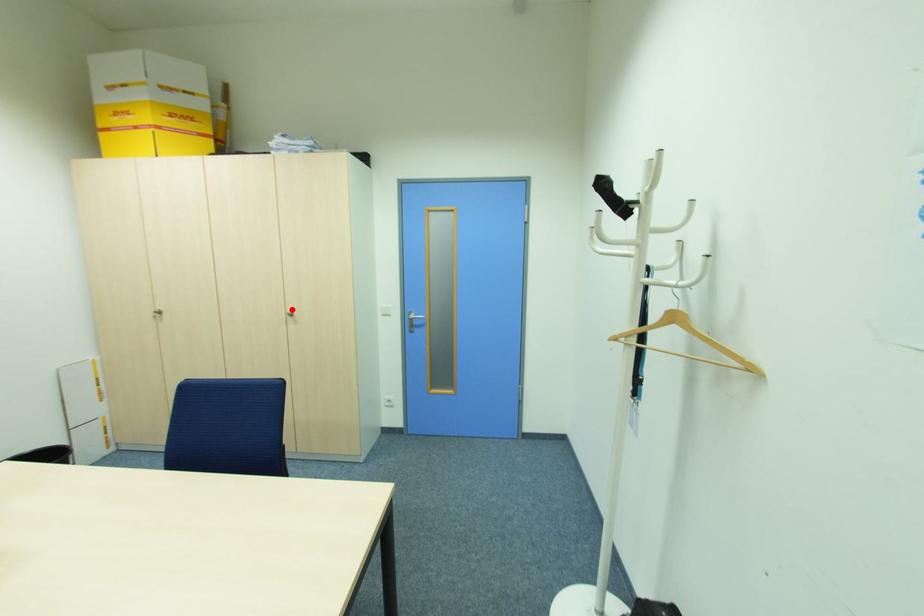
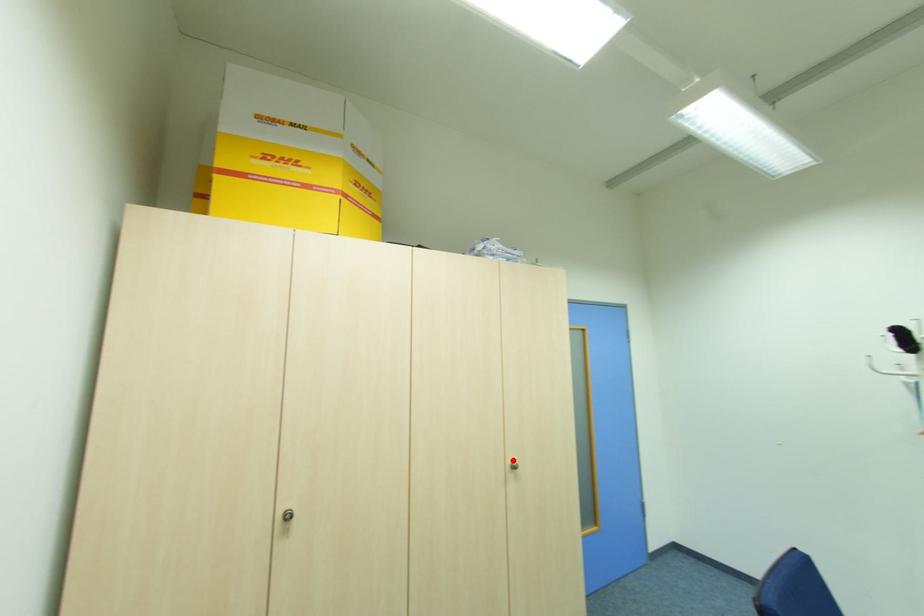
I am providing you with two images of the same scene from different viewpoints. A red point is marked on the first image and another point is marked on the second image. Are the points marked in image1 and image2 representing the same 3D position?

Yes